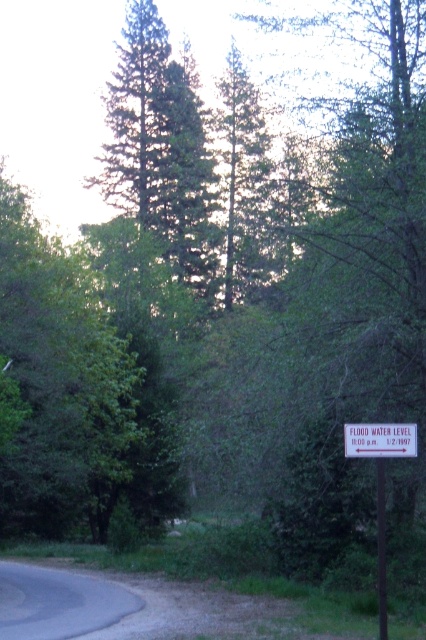
You are standing on the paved road in the forest and see the white plastic sign at lower right. If you want to reach the sign quickly, should you walk forward or turn around?

The white plastic sign at lower right is 10.15 meters away from viewer, so you should walk forward towards it to reach it quickly.

You are standing at the signpost in the forest and see two points marked on the road ahead. Which point is closer to you, point (377,566) or point (377,515)?

Point (377,566) is closer to you than point (377,515).

You are a hiker who just arrived at the forest trailhead. You see a white plastic sign at lower right and a metallic signpost at right. Which one is taller?

The white plastic sign at lower right is much taller than the metallic signpost at right.